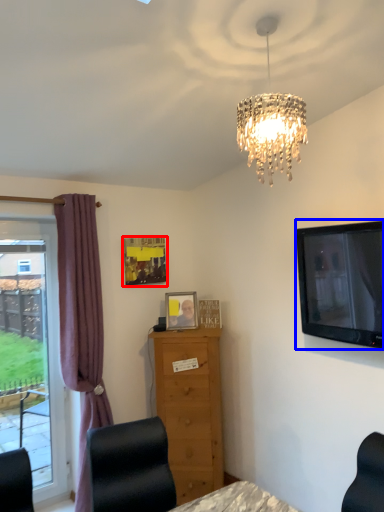
Question: Which point is closer to the camera, picture frame (highlighted by a red box) or television (highlighted by a blue box)?

Choices:
 (A) picture frame
 (B) television

Answer: (B)